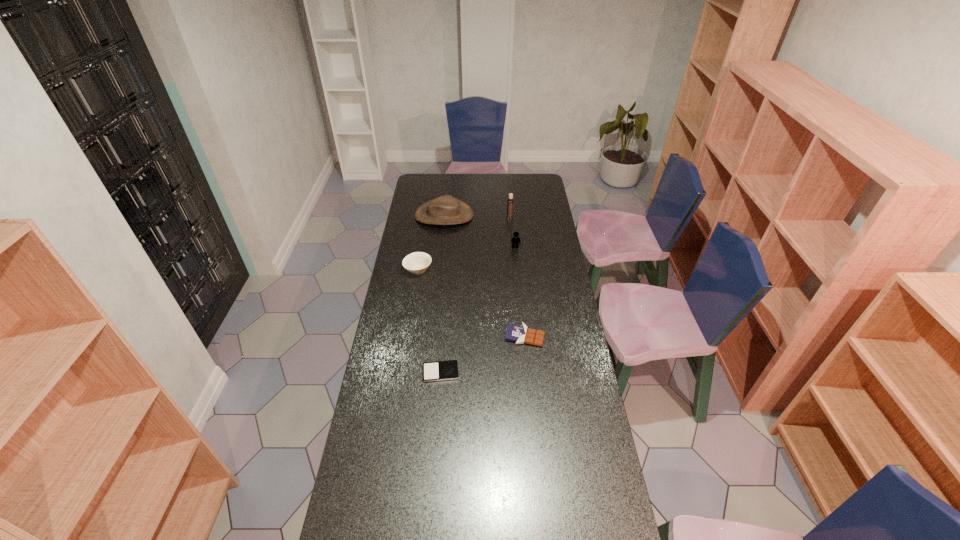
At what (x,y) coordinates should I click in order to perform the action: click on candle holder. Please return your answer as a coordinate pair (x, y). This screenshot has height=540, width=960. Looking at the image, I should click on (510, 200).

Identify the location of cowboy hat. click(444, 210).

The height and width of the screenshot is (540, 960). I want to click on the third farthest object, so click(515, 241).

The width and height of the screenshot is (960, 540). In order to click on the third nearest object in this screenshot , I will do `click(417, 262)`.

What are the coordinates of `bowl` in the screenshot? It's located at (417, 262).

I want to click on chocolate bar, so (520, 334).

Find the location of `the second nearest object`. the second nearest object is located at coordinates (520, 334).

At what (x,y) coordinates should I click in order to perform the action: click on the nearest object. Please return your answer as a coordinate pair (x, y). Looking at the image, I should click on (441, 370).

Image resolution: width=960 pixels, height=540 pixels. Find the location of `iPod`. iPod is located at coordinates (441, 370).

Find the location of a particular element. The image size is (960, 540). free space located 0.390m on the front of the tallest object is located at coordinates click(x=514, y=266).